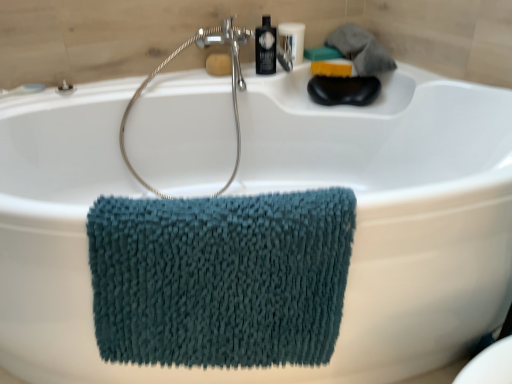
What do you see at coordinates (292, 40) in the screenshot?
I see `translucent plastic bottle at upper center` at bounding box center [292, 40].

Where is `yellow sponge at upper center, which appears as the first soap when viewed from the left`? Image resolution: width=512 pixels, height=384 pixels. yellow sponge at upper center, which appears as the first soap when viewed from the left is located at coordinates 219,64.

Identify the location of black glossy bottle at upper center. (265, 47).

Considering the relative positions of yellow sponge at upper right, which ranks as the 2th soap in left-to-right order, and satin nickel showerhead at upper center in the image provided, is yellow sponge at upper right, which ranks as the 2th soap in left-to-right order, to the right of satin nickel showerhead at upper center from the viewer's perspective?

Indeed, yellow sponge at upper right, which ranks as the 2th soap in left-to-right order, is positioned on the right side of satin nickel showerhead at upper center.

Between yellow sponge at upper right, which ranks as the 2th soap in left-to-right order, and satin nickel showerhead at upper center, which one has larger size?

satin nickel showerhead at upper center is bigger.

Which of these two, yellow sponge at upper right, which is the first soap from right to left, or satin nickel showerhead at upper center, stands taller?

With more height is satin nickel showerhead at upper center.

What's the angular difference between yellow sponge at upper right, which is the first soap from right to left, and satin nickel showerhead at upper center's facing directions?

The angular difference between yellow sponge at upper right, which is the first soap from right to left, and satin nickel showerhead at upper center is 0.0603 degrees.

Is yellow sponge at upper center, placed as the 2th soap when sorted from right to left, oriented towards teal chenille towel at center?

Yes, yellow sponge at upper center, placed as the 2th soap when sorted from right to left, is turned towards teal chenille towel at center.

Does point (220, 61) come in front of point (305, 195)?

No, it is not.

Can you confirm if yellow sponge at upper center, which appears as the first soap when viewed from the left, is shorter than teal chenille towel at center?

Correct, yellow sponge at upper center, which appears as the first soap when viewed from the left, is not as tall as teal chenille towel at center.

Considering the sizes of yellow sponge at upper center, which appears as the first soap when viewed from the left, and teal chenille towel at center in the image, is yellow sponge at upper center, which appears as the first soap when viewed from the left, bigger or smaller than teal chenille towel at center?

yellow sponge at upper center, which appears as the first soap when viewed from the left, is smaller than teal chenille towel at center.

From the image's perspective, is translucent plastic bottle at upper center located above or below black glossy bottle at upper center?

From the image's perspective, translucent plastic bottle at upper center appears above black glossy bottle at upper center.

Between translucent plastic bottle at upper center and black glossy bottle at upper center, which one has more height?

black glossy bottle at upper center.

Is translucent plastic bottle at upper center with black glossy bottle at upper center?

Yes, translucent plastic bottle at upper center is beside black glossy bottle at upper center.

In terms of width, does translucent plastic bottle at upper center look wider or thinner when compared to black glossy bottle at upper center?

In the image, translucent plastic bottle at upper center appears to be wider than black glossy bottle at upper center.

Which of these two, yellow sponge at upper right, which ranks as the 2th soap in left-to-right order, or translucent plastic bottle at upper center, is wider?

With larger width is yellow sponge at upper right, which ranks as the 2th soap in left-to-right order.

Is translucent plastic bottle at upper center inside yellow sponge at upper right, which ranks as the 2th soap in left-to-right order?

Definitely not — translucent plastic bottle at upper center is not inside yellow sponge at upper right, which ranks as the 2th soap in left-to-right order.

Is point (335, 62) farther from viewer compared to point (285, 50)?

Yes, point (335, 62) is farther from viewer.

Which is more to the left, yellow sponge at upper right, which ranks as the 2th soap in left-to-right order, or translucent plastic bottle at upper center?

translucent plastic bottle at upper center.

Does translucent plastic bottle at upper center have a larger size compared to satin nickel showerhead at upper center?

No.

From a real-world perspective, is translucent plastic bottle at upper center physically below satin nickel showerhead at upper center?

No, from a real-world perspective, translucent plastic bottle at upper center is not beneath satin nickel showerhead at upper center.

What's the angular difference between translucent plastic bottle at upper center and satin nickel showerhead at upper center's facing directions?

0.0603 degrees separate the facing orientations of translucent plastic bottle at upper center and satin nickel showerhead at upper center.

From the image's perspective, which one is positioned lower, black glossy bottle at upper center or yellow sponge at upper center, placed as the 2th soap when sorted from right to left?

From the image's view, yellow sponge at upper center, placed as the 2th soap when sorted from right to left, is below.

Between black glossy bottle at upper center and yellow sponge at upper center, which appears as the first soap when viewed from the left, which one has more height?

black glossy bottle at upper center is taller.

Is black glossy bottle at upper center thinner than yellow sponge at upper center, placed as the 2th soap when sorted from right to left?

No, black glossy bottle at upper center is not thinner than yellow sponge at upper center, placed as the 2th soap when sorted from right to left.

Is black glossy bottle at upper center next to yellow sponge at upper center, placed as the 2th soap when sorted from right to left, and touching it?

No, black glossy bottle at upper center is not next to yellow sponge at upper center, placed as the 2th soap when sorted from right to left.

Considering the sizes of teal chenille towel at center and black glossy bottle at upper center in the image, is teal chenille towel at center taller or shorter than black glossy bottle at upper center?

Considering their sizes, teal chenille towel at center has more height than black glossy bottle at upper center.

Which object is further away from the camera, teal chenille towel at center or black glossy bottle at upper center?

black glossy bottle at upper center.

From a real-world perspective, who is located lower, teal chenille towel at center or black glossy bottle at upper center?

teal chenille towel at center.

Does point (230, 243) come closer to viewer compared to point (271, 42)?

Yes, it is in front of point (271, 42).

You are a GUI agent. You are given a task and a screenshot of the screen. Output one action in this format:
    pyautogui.click(x=<x>, y=<y>)
    Task: Click on the shower on the left of the yellow sponge at upper right, which ranks as the 2th soap in left-to-right order
    This screenshot has height=384, width=512.
    Given the screenshot: What is the action you would take?
    pyautogui.click(x=232, y=87)

Identify the location of the 2nd soap above the teal chenille towel at center (from a real-world perspective). The height and width of the screenshot is (384, 512). (219, 64).

When comparing their distances from translucent plastic bottle at upper center, does yellow sponge at upper center, which appears as the first soap when viewed from the left, or yellow sponge at upper right, which ranks as the 2th soap in left-to-right order, seem further?

Among the two, yellow sponge at upper center, which appears as the first soap when viewed from the left, is located further to translucent plastic bottle at upper center.

Estimate the real-world distances between objects in this image. Which object is closer to translucent plastic bottle at upper center, satin nickel showerhead at upper center or yellow sponge at upper center, placed as the 2th soap when sorted from right to left?

Among the two, yellow sponge at upper center, placed as the 2th soap when sorted from right to left, is located nearer to translucent plastic bottle at upper center.

Looking at the image, which one is located closer to translucent plastic bottle at upper center, teal chenille towel at center or yellow sponge at upper right, which ranks as the 2th soap in left-to-right order?

yellow sponge at upper right, which ranks as the 2th soap in left-to-right order.

Looking at the image, which one is located further to black glossy bottle at upper center, satin nickel showerhead at upper center or teal chenille towel at center?

teal chenille towel at center lies further to black glossy bottle at upper center than the other object.

When comparing their distances from yellow sponge at upper center, which appears as the first soap when viewed from the left, does satin nickel showerhead at upper center or yellow sponge at upper right, which ranks as the 2th soap in left-to-right order, seem further?

yellow sponge at upper right, which ranks as the 2th soap in left-to-right order, is positioned further to the anchor yellow sponge at upper center, which appears as the first soap when viewed from the left.

From the picture: Estimate the real-world distances between objects in this image. Which object is closer to satin nickel showerhead at upper center, translucent plastic bottle at upper center or black glossy bottle at upper center?

black glossy bottle at upper center is closer to satin nickel showerhead at upper center.

Estimate the real-world distances between objects in this image. Which object is closer to translucent plastic bottle at upper center, satin nickel showerhead at upper center or teal chenille towel at center?

The object closer to translucent plastic bottle at upper center is satin nickel showerhead at upper center.

Considering their positions, is satin nickel showerhead at upper center positioned further to translucent plastic bottle at upper center than black glossy bottle at upper center?

satin nickel showerhead at upper center is further to translucent plastic bottle at upper center.

The height and width of the screenshot is (384, 512). In order to click on cleaning product located between satin nickel showerhead at upper center and translucent plastic bottle at upper center in the depth direction in this screenshot , I will do `click(265, 47)`.

Find the location of `toiletry located between black glossy bottle at upper center and yellow sponge at upper right, which ranks as the 2th soap in left-to-right order, in the left-right direction`. toiletry located between black glossy bottle at upper center and yellow sponge at upper right, which ranks as the 2th soap in left-to-right order, in the left-right direction is located at coordinates (292, 40).

This screenshot has width=512, height=384. What are the coordinates of `cleaning product between satin nickel showerhead at upper center and yellow sponge at upper center, placed as the 2th soap when sorted from right to left, from front to back` in the screenshot? It's located at [x=265, y=47].

I want to click on cleaning product located between teal chenille towel at center and translucent plastic bottle at upper center in the depth direction, so click(265, 47).